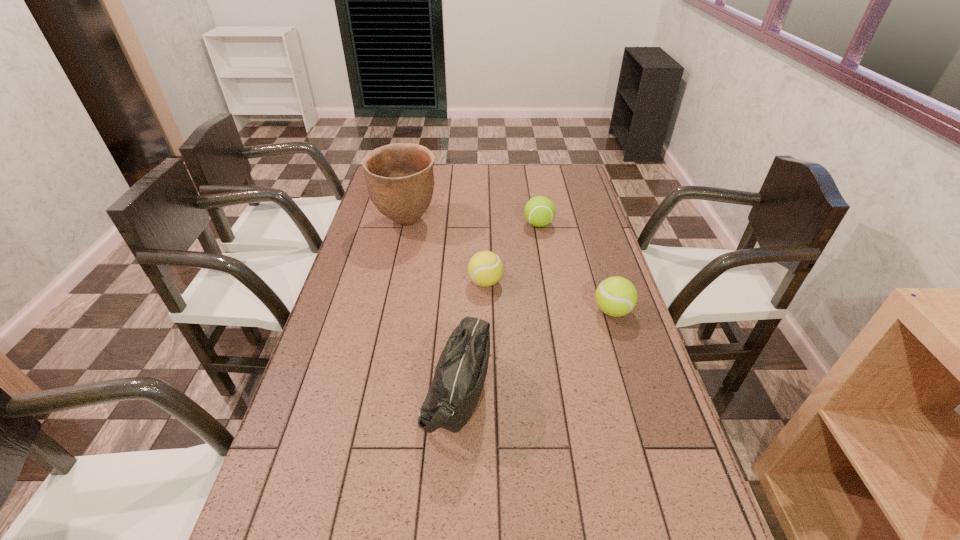
Locate an element on the screen. This screenshot has height=540, width=960. free space located on the front of the leftmost object is located at coordinates (384, 322).

This screenshot has width=960, height=540. I want to click on vacant position located at the front padded panel of the second tallest object, so click(572, 390).

What are the coordinates of `vacant space located 0.340m on the back of the rightmost object` in the screenshot? It's located at (588, 234).

Locate an element on the screen. This screenshot has height=540, width=960. vacant region located 0.110m on the back of the second tennis ball from right to left is located at coordinates (535, 201).

At what (x,y) coordinates should I click in order to perform the action: click on vacant area situated on the left of the second farthest tennis ball. Please return your answer as a coordinate pair (x, y). This screenshot has width=960, height=540. Looking at the image, I should click on (452, 282).

Where is `object positioned at the left edge`? The image size is (960, 540). object positioned at the left edge is located at coordinates (399, 177).

The height and width of the screenshot is (540, 960). Find the location of `object located in the right edge section of the desktop`. object located in the right edge section of the desktop is located at coordinates (616, 296).

Locate an element on the screen. This screenshot has width=960, height=540. vacant space at the far edge of the desktop is located at coordinates (474, 165).

Where is `vacant space at the left edge`? vacant space at the left edge is located at coordinates (372, 341).

In the image, there is a desktop. Where is `free region at the right edge`? free region at the right edge is located at coordinates (586, 198).